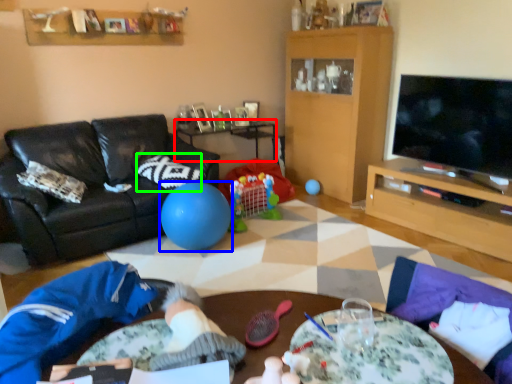
Question: Considering the real-world distances, which object is closest to table (highlighted by a red box)? ball (highlighted by a blue box) or pillow (highlighted by a green box).

Choices:
 (A) ball
 (B) pillow

Answer: (B)